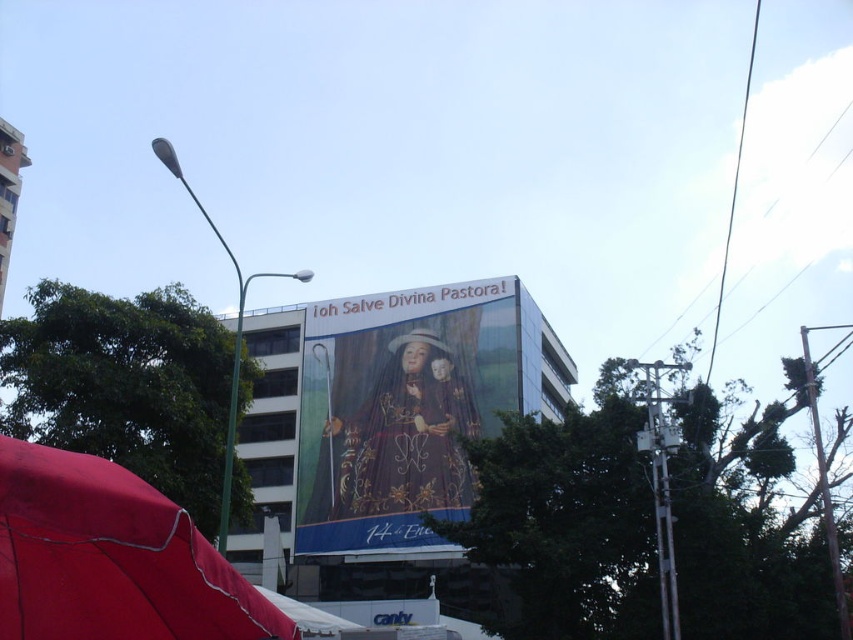
You are an art student who wants to sketch the scene. You notice the matte gold painting at center and the red fabric umbrella at lower left. Which object should you focus on first if you want to draw the wider object?

The matte gold painting at center might be wider than red fabric umbrella at lower left, so you should focus on the matte gold painting at center first.

You are a drone operator trying to capture aerial footage of the urban scene. You have two points marked on your map for drone navigation. The first point is at coordinate point (x=413, y=486) and the second is at point (x=202, y=580). If you want to fly the drone from the first point to the second point, will the drone have to pass over any obstacles between them?

Point (x=413, y=486) is behind point (x=202, y=580), so the drone will not have to pass over any obstacles between them.